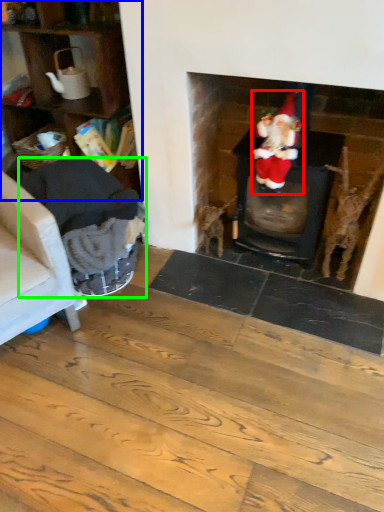
Question: Which is nearer to the person (highlighted by a red box)? shelf (highlighted by a blue box) or armchair (highlighted by a green box).

Choices:
 (A) shelf
 (B) armchair

Answer: (B)